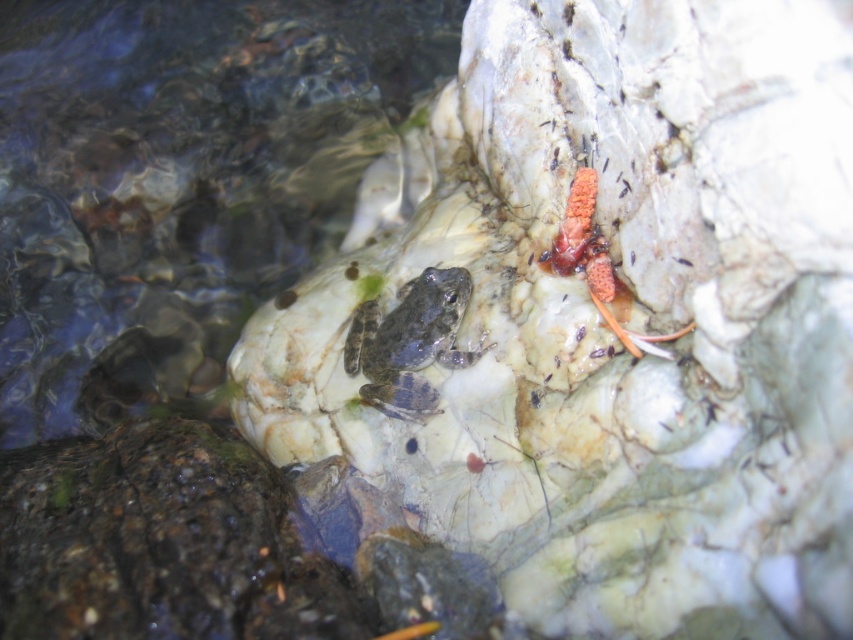
You are standing in a natural setting and see the speckled stone at center. If you want to reach it without moving your feet, can you touch it with your hand?

The speckled stone at center is 21.11 inches away from you, so if you can extend your arm that far, you can touch it without moving your feet.

You are an underwater photographer aiming to capture both the speckled stone at center and the spongy orange coral at upper right in a single frame. Based on their positions, which object should you focus on first to ensure both are in focus?

The speckled stone at center is located below the spongy orange coral at upper right. To capture both in focus, you should focus on the speckled stone at center first since it is closer to the camera, allowing the coral to be in the same focal plane.